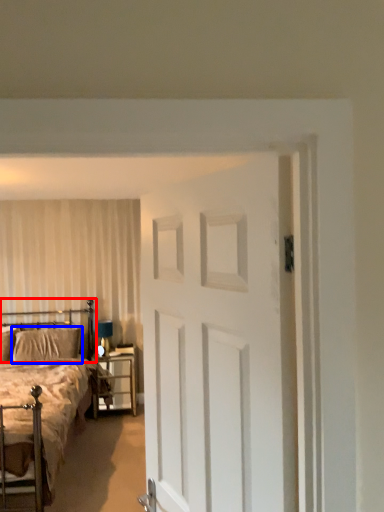
Question: Which object appears farthest to the camera in this image, headboard (highlighted by a red box) or pillow (highlighted by a blue box)?

Choices:
 (A) headboard
 (B) pillow

Answer: (B)